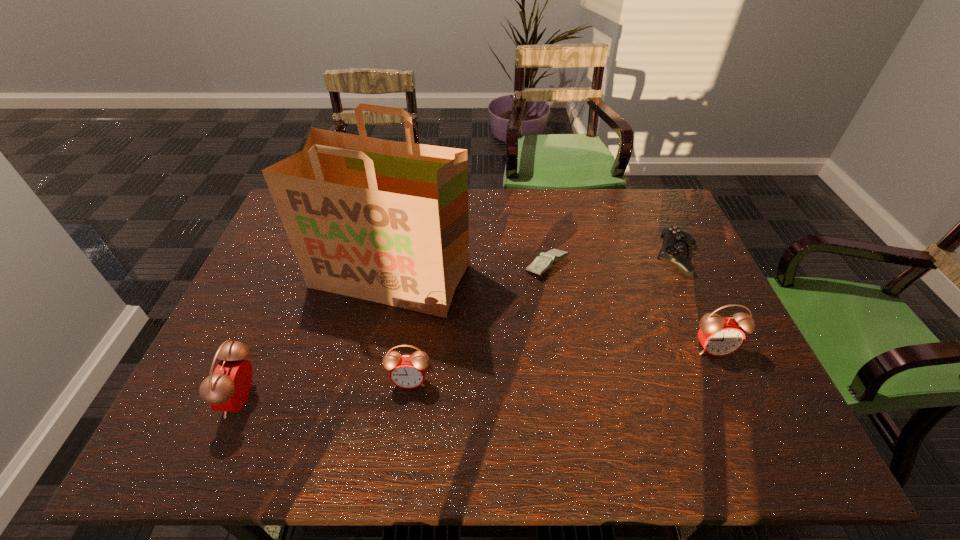
Locate an element on the screen. vacant spot for a new alarm_clock to ensure equal spacing is located at coordinates (566, 364).